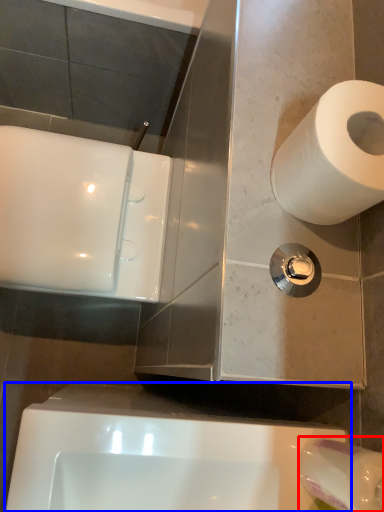
Question: Which object appears farthest to the camera in this image, toilet paper (highlighted by a red box) or bath (highlighted by a blue box)?

Choices:
 (A) toilet paper
 (B) bath

Answer: (B)